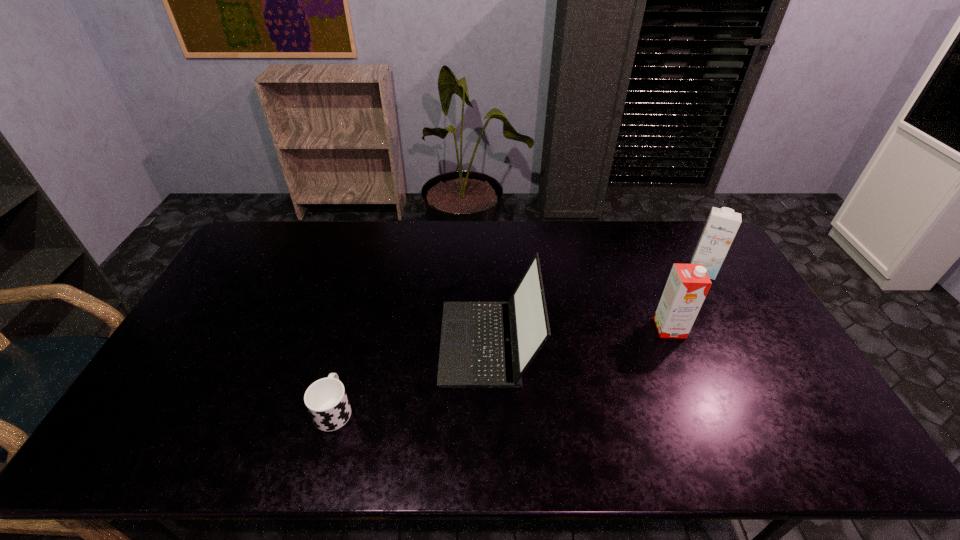
Where is `vacant space that satisfies the following two spatial constraints: 1. on the side of the leftmost object with the handle; 2. on the left side of the farthest object`? This screenshot has height=540, width=960. vacant space that satisfies the following two spatial constraints: 1. on the side of the leftmost object with the handle; 2. on the left side of the farthest object is located at coordinates (372, 269).

Image resolution: width=960 pixels, height=540 pixels. In order to click on free spot that satisfies the following two spatial constraints: 1. on the side of the leftmost object with the handle; 2. on the left side of the farthest object in this screenshot , I will do `click(372, 269)`.

I want to click on free space that satisfies the following two spatial constraints: 1. on the side of the nearest object with the handle; 2. on the right side of the right carton, so click(372, 269).

Image resolution: width=960 pixels, height=540 pixels. Find the location of `free point that satisfies the following two spatial constraints: 1. on the side of the nearer carton with the handle; 2. on the left side of the nearest object`. free point that satisfies the following two spatial constraints: 1. on the side of the nearer carton with the handle; 2. on the left side of the nearest object is located at coordinates (356, 328).

Find the location of a particular element. The width and height of the screenshot is (960, 540). vacant space that satisfies the following two spatial constraints: 1. on the side of the third object from left to right with the handle; 2. on the right side of the leftmost object is located at coordinates (356, 328).